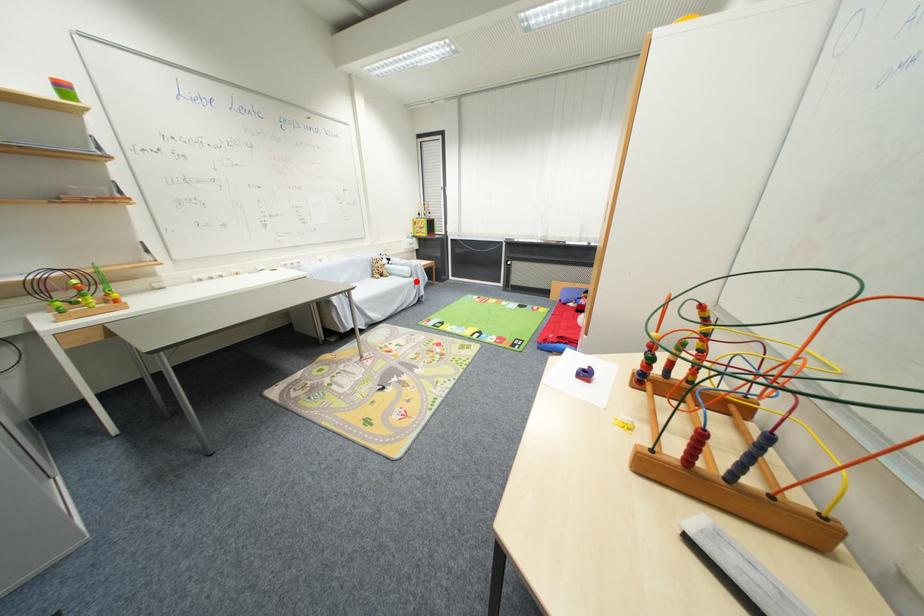
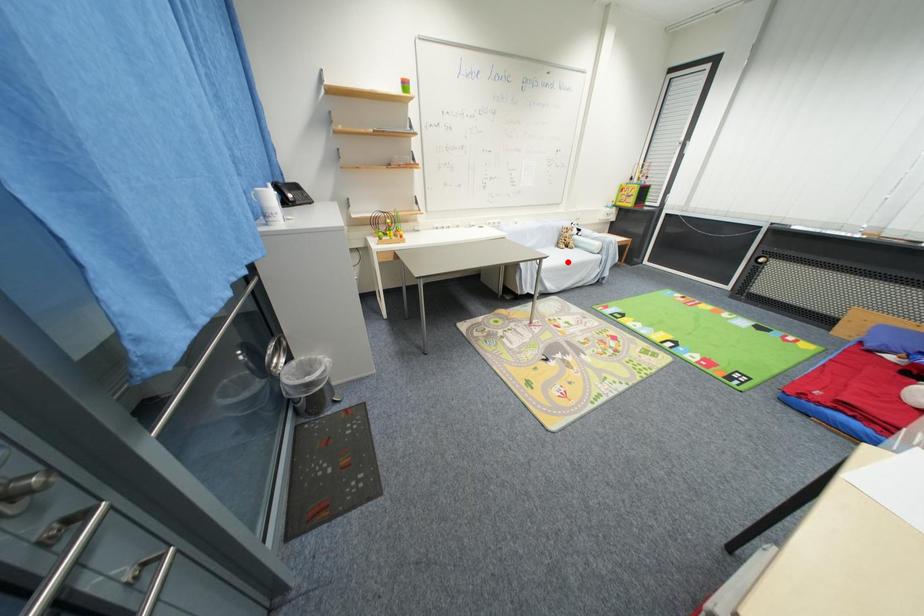
I am providing you with two images of the same scene from different viewpoints. A red point is marked on the first image and another point is marked on the second image. Does the point marked in image1 correspond to the same location as the one in image2?

No